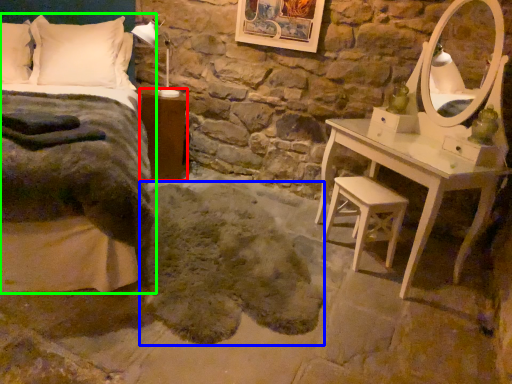
Question: Which object is the closest to the nightstand (highlighted by a red box)? Choose among these: animal (highlighted by a blue box) or bed (highlighted by a green box).

Choices:
 (A) animal
 (B) bed

Answer: (B)